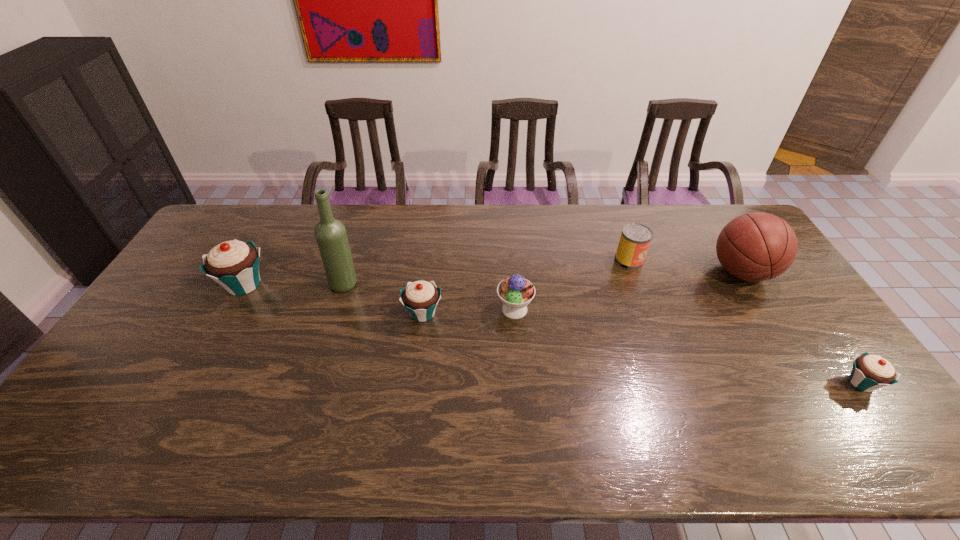
Identify the location of free area in between the fourth object from right to left and the leftmost object. This screenshot has height=540, width=960. (379, 297).

Locate an element on the screen. free space between the fifth object from left to right and the shortest cupcake is located at coordinates (745, 321).

Identify the location of vacant space in between the leftmost object and the wine bottle. The height and width of the screenshot is (540, 960). (295, 285).

The width and height of the screenshot is (960, 540). I want to click on unoccupied area between the can and the leftmost cupcake, so pyautogui.click(x=437, y=272).

The width and height of the screenshot is (960, 540). Identify the location of vacant space in between the icecream and the nearest object. (688, 346).

Where is `free space between the fifth object from left to right and the tallest object`? This screenshot has height=540, width=960. free space between the fifth object from left to right and the tallest object is located at coordinates (487, 272).

This screenshot has height=540, width=960. I want to click on free area in between the fifth object from left to right and the shortest cupcake, so coord(745,321).

Find the location of `empty space that is in between the icecream and the tallest cupcake`. empty space that is in between the icecream and the tallest cupcake is located at coordinates (379, 297).

You are a GUI agent. You are given a task and a screenshot of the screen. Output one action in this format:
    pyautogui.click(x=<x>, y=<y>)
    Task: Click on the object identified as the closest to the fourth object from right to left
    The image size is (960, 540).
    Given the screenshot: What is the action you would take?
    pyautogui.click(x=420, y=298)

This screenshot has width=960, height=540. What are the coordinates of `the closest object relative to the shortest object` in the screenshot? It's located at (758, 246).